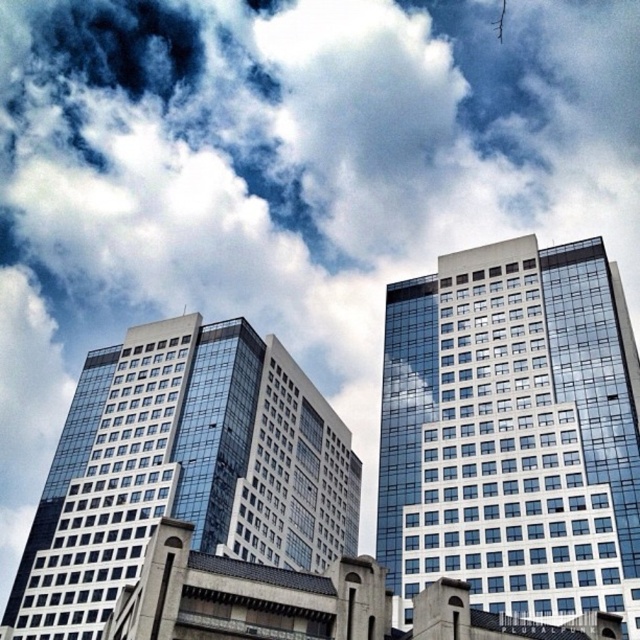
Which is below, glassy reflective building at upper center or glassy reflective building at center?

glassy reflective building at center

Can you confirm if glassy reflective building at upper center is smaller than glassy reflective building at center?

Indeed, glassy reflective building at upper center has a smaller size compared to glassy reflective building at center.

Is point (410, 413) positioned before point (184, 499)?

Yes, it is in front of point (184, 499).

This screenshot has width=640, height=640. Find the location of `glassy reflective building at upper center`. glassy reflective building at upper center is located at coordinates (513, 433).